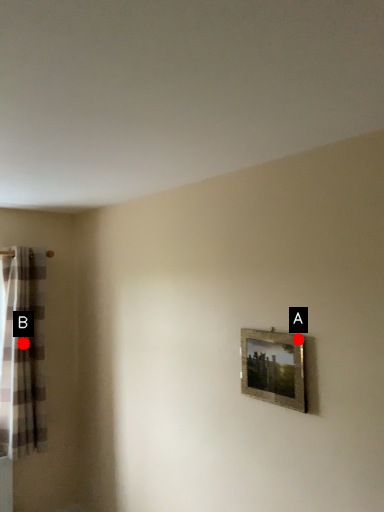
Question: Two points are circled on the image, labeled by A and B beside each circle. Which point appears closest to the camera in this image?

Choices:
 (A) A is closer
 (B) B is closer

Answer: (A)